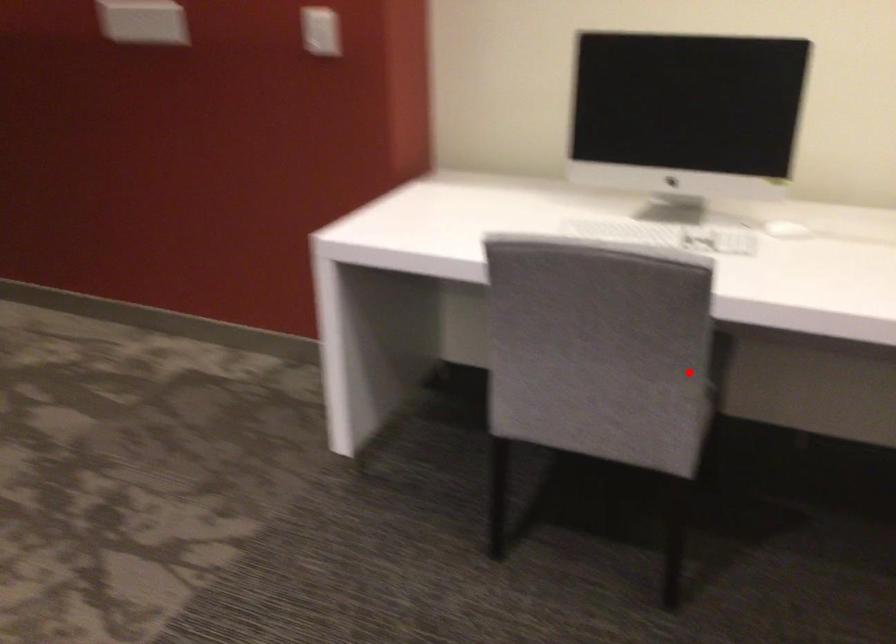
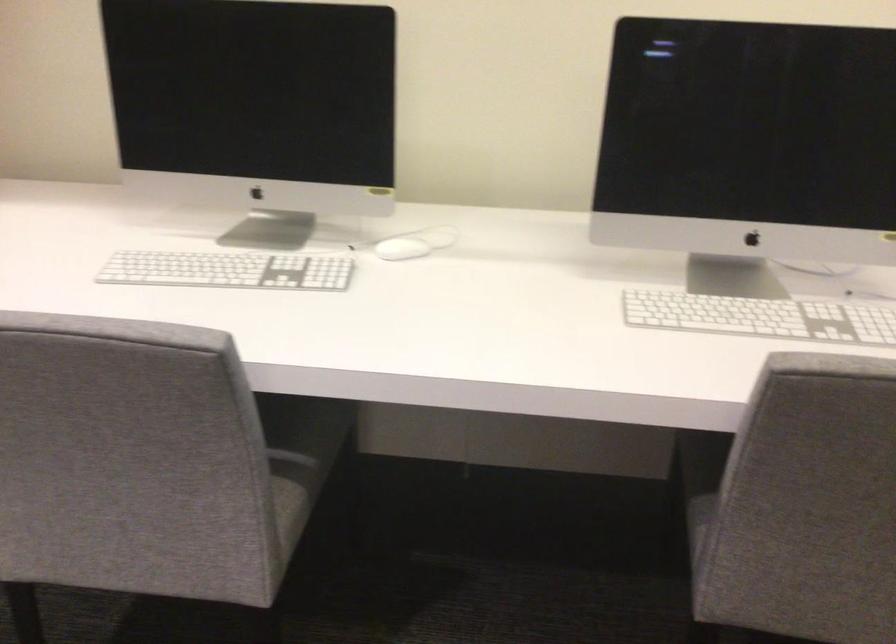
Question: I am providing you with two images of the same scene from different viewpoints. In image1, a red point is highlighted. Considering the same 3D point in image2, which of the following is correct?

Choices:
 (A) It is closer
 (B) It is farther

Answer: (A)